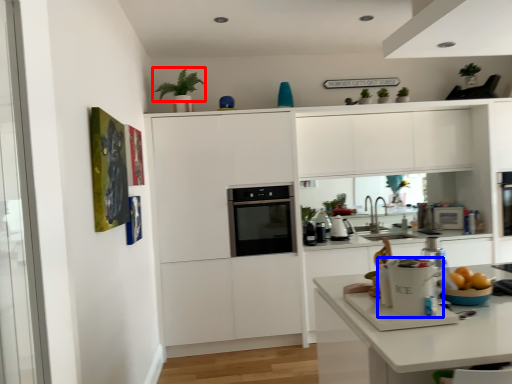
Question: Which of the following is the closest to the observer, plant (highlighted by a red box) or kitchen appliance (highlighted by a blue box)?

Choices:
 (A) plant
 (B) kitchen appliance

Answer: (B)